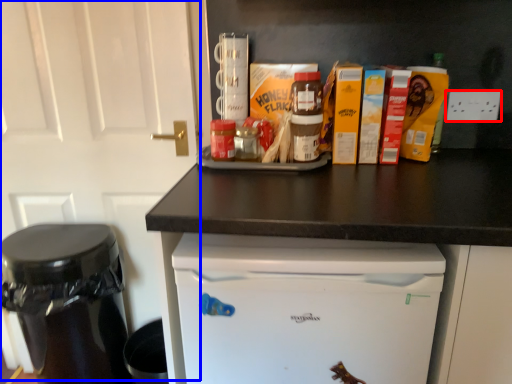
Question: Among these objects, which one is nearest to the camera, electric outlet (highlighted by a red box) or door (highlighted by a blue box)?

Choices:
 (A) electric outlet
 (B) door

Answer: (B)